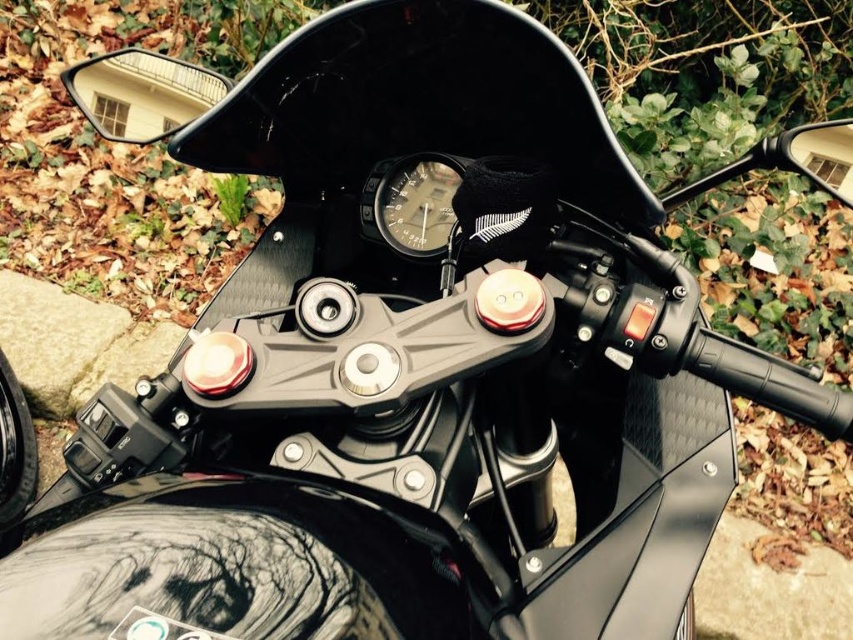
You are a rider checking the motorcycle controls. You notice the matte black speedometer at center and the glossy black mirror at upper right. Which object is located to the right of the other?

The glossy black mirror at upper right is located to the right of the matte black speedometer at center.

You are a rider who wants to check both the matte black mirror at upper left and the camera while driving. Can you reach both without moving your head?

Result: The matte black mirror at upper left and camera are 37.28 inches apart, so the rider can easily reach both without moving their head since the distance is within a comfortable range for checking while driving.

You are a rider checking your motorcycle mirrors. Which mirror, the matte black mirror at upper left or the glossy black mirror at upper right, is located higher on the motorcycle?

The matte black mirror at upper left is positioned over the glossy black mirror at upper right, so it is higher.